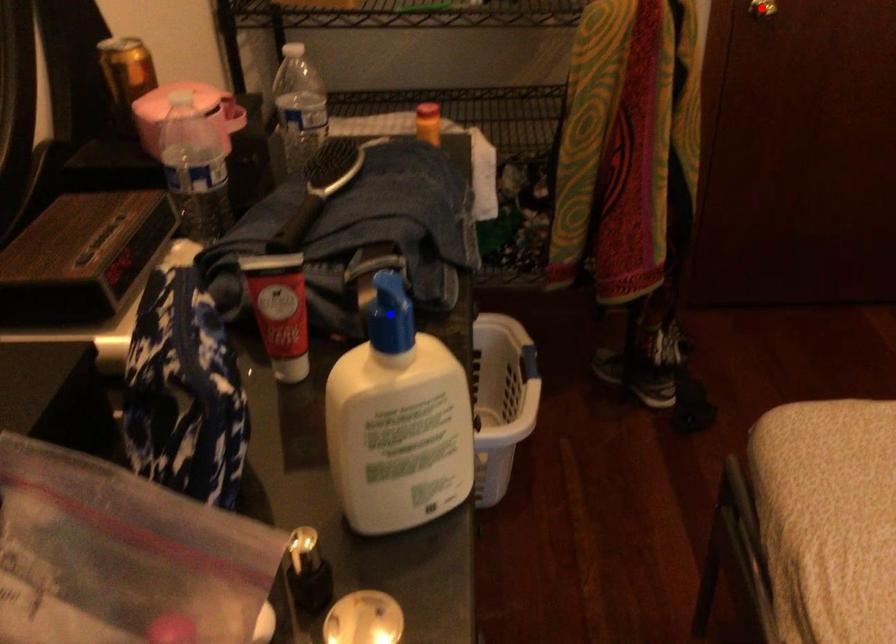
Question: In the image, two points are highlighted. Which point is nearer to the camera? Reply with the corresponding letter.

Choices:
 (A) blue point
 (B) red point

Answer: (A)